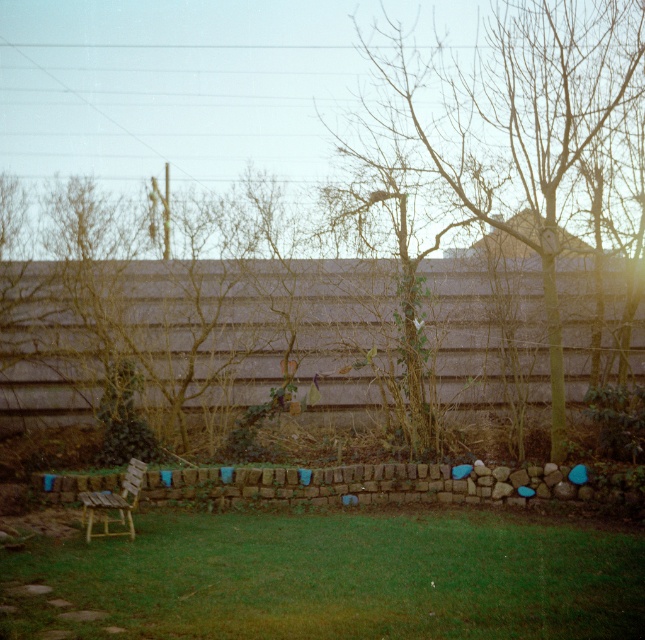
You are planning to place a small garden ornament that requires a flat, stable surface. Which object between the green grass at lower left and the bare wood tree at center would be more suitable for placing the ornament?

The green grass at lower left is thinner than the bare wood tree at center, so the green grass at lower left would provide a more stable surface for placing the ornament.

You are standing at the center of the image and want to walk towards the green grass at lower left. In which direction should you move?

You should move towards the lower left direction to reach the green grass at lower left.